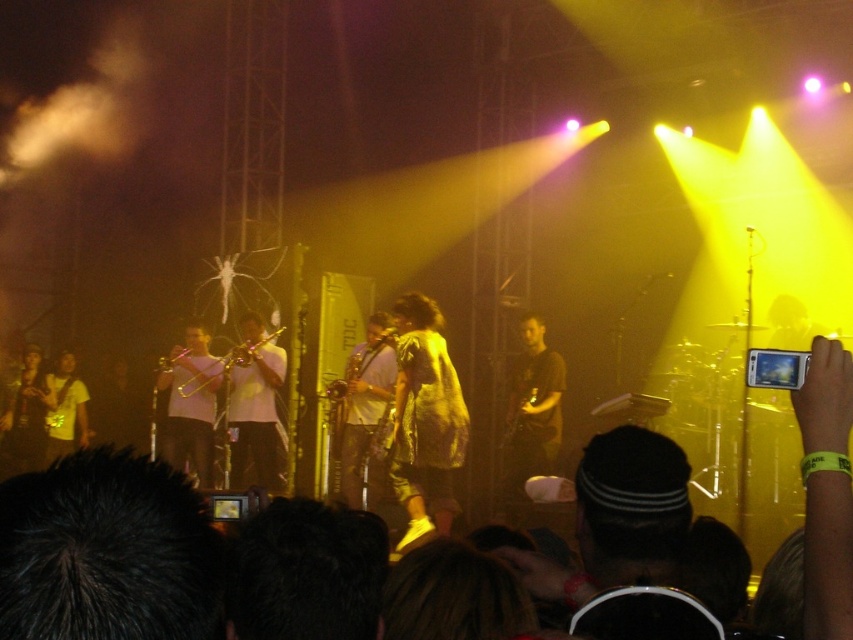
Who is taller, shiny metallic shirt at center or white matte trumpet at center?

With more height is shiny metallic shirt at center.

Which is in front, point (433, 333) or point (183, 403)?

Point (433, 333) is more forward.

Find the location of a particular element. This screenshot has height=640, width=853. shiny metallic shirt at center is located at coordinates (425, 420).

Which is more to the left, shiny metallic shirt at center or yellow shirt at left?

yellow shirt at left

Looking at this image, who is lower down, shiny metallic shirt at center or yellow shirt at left?

yellow shirt at left is below.

Between point (440, 344) and point (53, 456), which one is positioned behind?

The point (53, 456) is more distant.

Identify the location of shiny metallic shirt at center. (425, 420).

Who is positioned more to the right, yellow shirt at left or metallic gold guitar at center?

metallic gold guitar at center is more to the right.

Does yellow shirt at left appear over metallic gold guitar at center?

Actually, yellow shirt at left is below metallic gold guitar at center.

Image resolution: width=853 pixels, height=640 pixels. I want to click on yellow shirt at left, so click(67, 410).